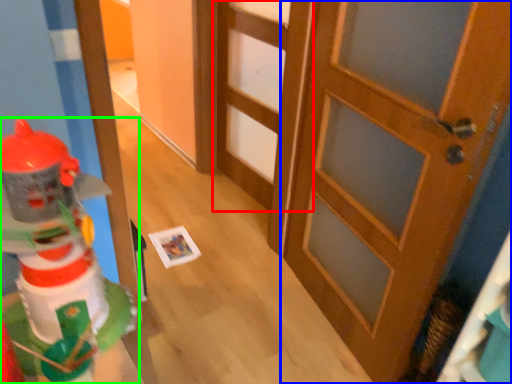
Question: Which is farther away from door (highlighted by a red box)? door (highlighted by a blue box) or toy (highlighted by a green box)?

Choices:
 (A) door
 (B) toy

Answer: (B)